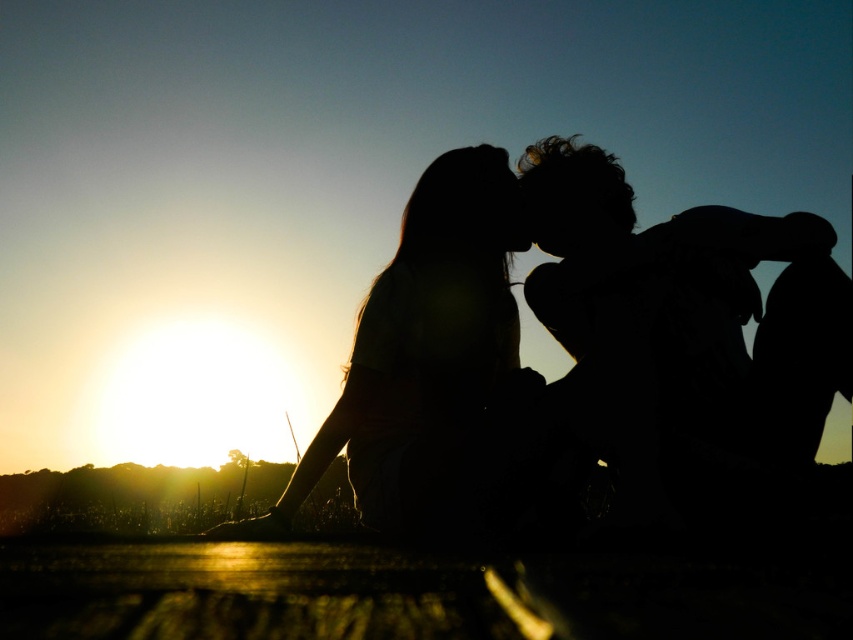
Question: Is silhouette hair at right positioned at the back of silhouette hair at center?

Choices:
 (A) no
 (B) yes

Answer: (A)

Question: Which point is farther to the camera?

Choices:
 (A) silhouette hair at center
 (B) silhouette hair at right

Answer: (A)

Question: From the image, what is the correct spatial relationship of silhouette hair at right in relation to silhouette hair at center?

Choices:
 (A) above
 (B) below

Answer: (A)

Question: Does silhouette hair at right have a smaller size compared to silhouette hair at center?

Choices:
 (A) no
 (B) yes

Answer: (A)